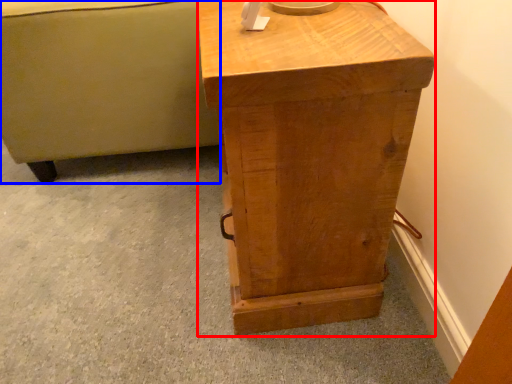
Question: Which object appears farthest to the camera in this image, nightstand (highlighted by a red box) or furniture (highlighted by a blue box)?

Choices:
 (A) nightstand
 (B) furniture

Answer: (B)